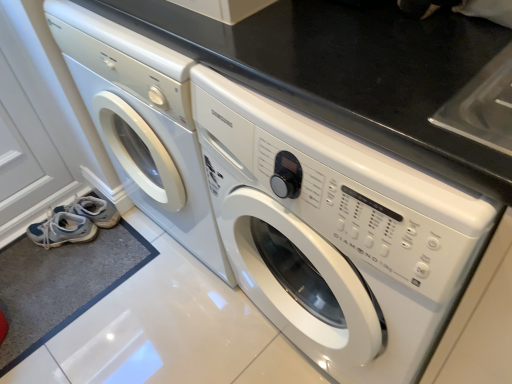
The height and width of the screenshot is (384, 512). Find the location of `vacant space underneath light blue fabric shoe at lower left, which is the first shoe from bottom to top (from a real-world perspective)`. vacant space underneath light blue fabric shoe at lower left, which is the first shoe from bottom to top (from a real-world perspective) is located at coordinates (72, 243).